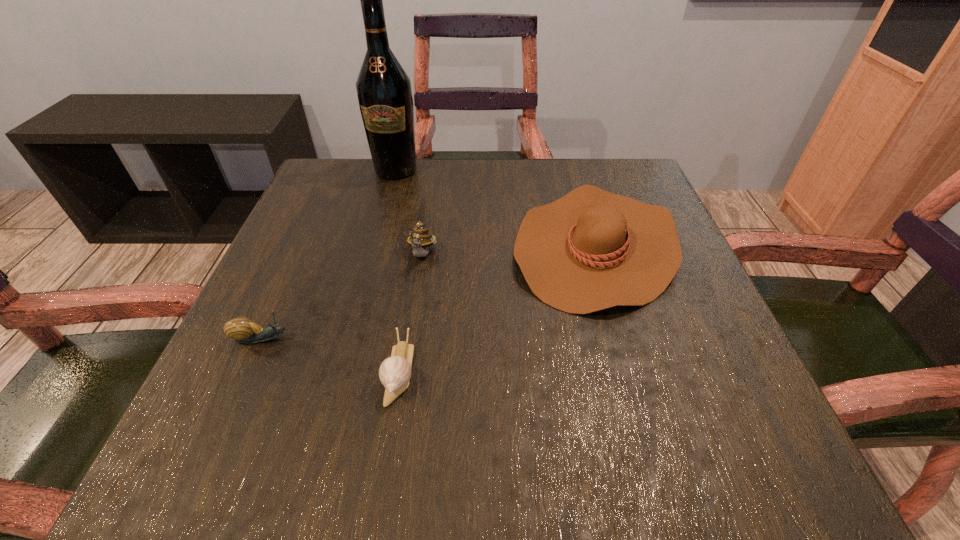
Image resolution: width=960 pixels, height=540 pixels. Find the location of `the farthest object`. the farthest object is located at coordinates (384, 92).

Locate an element on the screen. This screenshot has width=960, height=540. the second object from left to right is located at coordinates 384,92.

Where is `the tallest escargot`? the tallest escargot is located at coordinates (420, 239).

At what (x,y) coordinates should I click in order to perform the action: click on the fourth shortest object. Please return your answer as a coordinate pair (x, y). The width and height of the screenshot is (960, 540). Looking at the image, I should click on (420, 239).

You are a GUI agent. You are given a task and a screenshot of the screen. Output one action in this format:
    pyautogui.click(x=<x>, y=<y>)
    Task: Click on the cowboy hat
    The height and width of the screenshot is (540, 960).
    Given the screenshot: What is the action you would take?
    pyautogui.click(x=590, y=250)

In order to click on the rightmost object in this screenshot , I will do `click(590, 250)`.

Identify the location of the leftmost escargot. This screenshot has width=960, height=540. tap(243, 330).

Identify the location of free space located 0.220m on the label of the wine bottle. The height and width of the screenshot is (540, 960). [x=377, y=241].

I want to click on free location located 0.300m on the face of the second tallest object, so click(398, 422).

You are a GUI agent. You are given a task and a screenshot of the screen. Output one action in this format:
    pyautogui.click(x=<x>, y=<y>)
    Task: Click on the vacant space located on the left of the cowboy hat
    
    Given the screenshot: What is the action you would take?
    pyautogui.click(x=418, y=246)